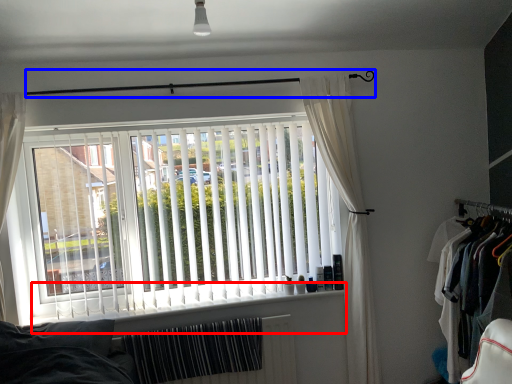
Question: Which object is closer to the camera taking this photo, window sill (highlighted by a red box) or clothesline (highlighted by a blue box)?

Choices:
 (A) window sill
 (B) clothesline

Answer: (B)